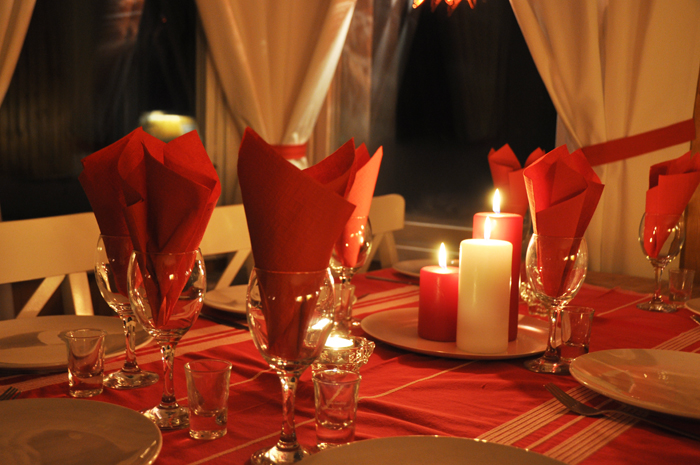
Where is `shot glasses`? The height and width of the screenshot is (465, 700). shot glasses is located at coordinates (85, 361), (203, 391), (330, 396), (570, 334), (679, 286).